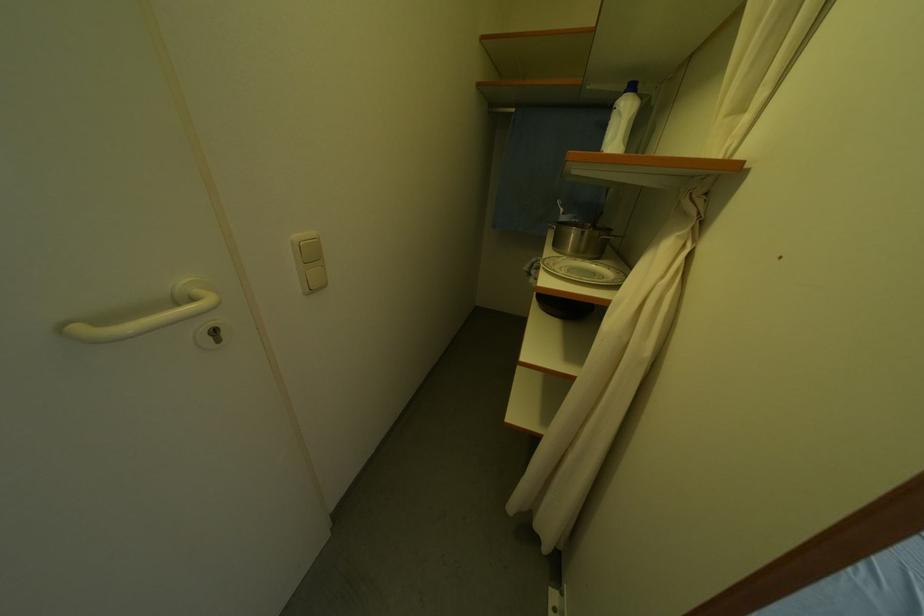
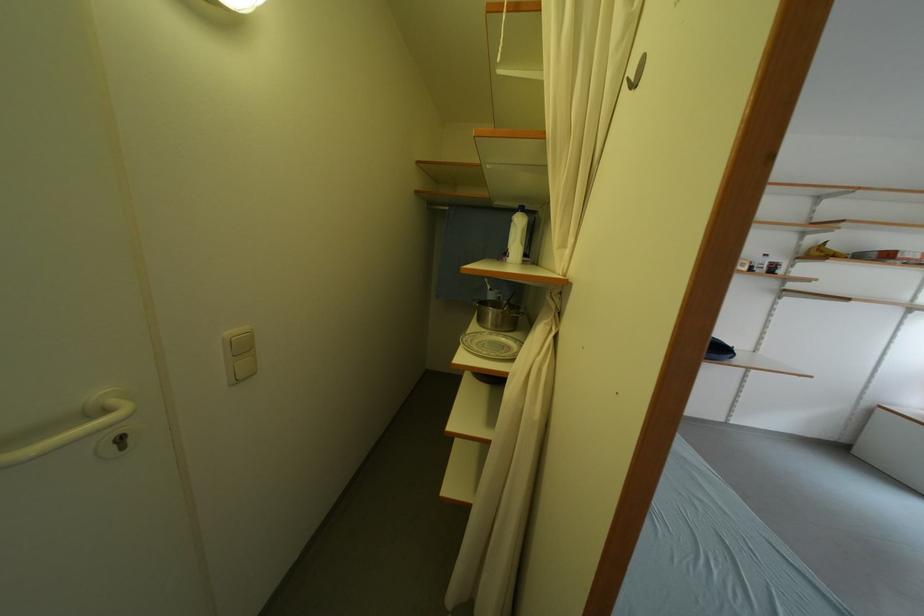
Find the pixel in the second image that matches the point at 306,238 in the first image.

(237, 336)